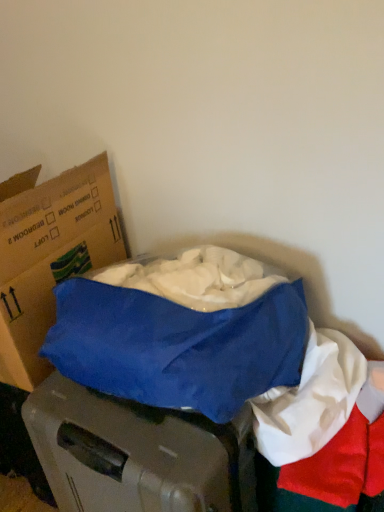
You are a GUI agent. You are given a task and a screenshot of the screen. Output one action in this format:
    pyautogui.click(x=<x>, y=<y>)
    Task: Click on the blue fabric at center
    Image resolution: width=384 pixels, height=512 pixels.
    Given the screenshot: What is the action you would take?
    pyautogui.click(x=310, y=400)

This screenshot has width=384, height=512. Describe the element at coordinates (310, 400) in the screenshot. I see `blue fabric at center` at that location.

What is the approximate height of blue fabric at center?

The height of blue fabric at center is 31.95 inches.

Where is `cardboard box at left`? This screenshot has width=384, height=512. cardboard box at left is located at coordinates (50, 258).

The image size is (384, 512). Describe the element at coordinates (50, 258) in the screenshot. I see `cardboard box at left` at that location.

Identify the location of blue fabric at center. This screenshot has width=384, height=512. (310, 400).

Considering the relative positions of blue fabric at center and cardboard box at left in the image provided, is blue fabric at center to the left or to the right of cardboard box at left?

blue fabric at center is positioned on cardboard box at left's right side.

Between blue fabric at center and cardboard box at left, which one is positioned in front?

blue fabric at center is in front.

Is point (284, 450) closer or farther from the camera than point (77, 169)?

Point (284, 450) appears to be closer to the viewer than point (77, 169).

From the image's perspective, which one is positioned lower, blue fabric at center or cardboard box at left?

blue fabric at center is shown below in the image.

From a real-world perspective, which object stands above the other?

cardboard box at left.

Considering the sizes of objects blue fabric at center and cardboard box at left in the image provided, who is thinner, blue fabric at center or cardboard box at left?

blue fabric at center.

Considering the relative sizes of blue fabric at center and cardboard box at left in the image provided, is blue fabric at center shorter than cardboard box at left?

Yes, blue fabric at center is shorter than cardboard box at left.

Does blue fabric at center have a larger size compared to cardboard box at left?

Actually, blue fabric at center might be smaller than cardboard box at left.

Is blue fabric at center completely or partially outside of cardboard box at left?

That's correct, blue fabric at center is outside of cardboard box at left.

Is blue fabric at center far from cardboard box at left?

They are positioned close to each other.

Does blue fabric at center turn towards cardboard box at left?

No, blue fabric at center is not oriented towards cardboard box at left.

The width and height of the screenshot is (384, 512). I want to click on linen directly beneath the cardboard box at left (from a real-world perspective), so click(x=310, y=400).

Between cardboard box at left and blue fabric at center, which one appears on the right side from the viewer's perspective?

blue fabric at center.

Is cardboard box at left further to camera compared to blue fabric at center?

Yes, cardboard box at left is behind blue fabric at center.

Is point (49, 217) closer to viewer compared to point (315, 418)?

No, it is not.

From the image's perspective, which is above, cardboard box at left or blue fabric at center?

cardboard box at left, from the image's perspective.

From a real-world perspective, which is physically below, cardboard box at left or blue fabric at center?

From a 3D spatial view, blue fabric at center is below.

Is cardboard box at left wider or thinner than blue fabric at center?

Clearly, cardboard box at left has more width compared to blue fabric at center.

Considering the sizes of cardboard box at left and blue fabric at center in the image, is cardboard box at left taller or shorter than blue fabric at center?

cardboard box at left is taller than blue fabric at center.

Is cardboard box at left smaller than blue fabric at center?

Actually, cardboard box at left might be larger than blue fabric at center.

Is cardboard box at left completely or partially outside of blue fabric at center?

Indeed, cardboard box at left is completely outside blue fabric at center.

Is cardboard box at left beside blue fabric at center?

No, cardboard box at left is not beside blue fabric at center.

Consider the image. Is blue fabric at center at the back of cardboard box at left?

No, cardboard box at left's orientation is not away from blue fabric at center.

Looking at this image, what's the angular difference between cardboard box at left and blue fabric at center's facing directions?

There is a 0.322-degree angle between the facing directions of cardboard box at left and blue fabric at center.

How distant is cardboard box at left from blue fabric at center?

cardboard box at left and blue fabric at center are 25.37 inches apart.

Locate an element on the screen. The image size is (384, 512). linen below the cardboard box at left (from the image's perspective) is located at coordinates (310, 400).

The image size is (384, 512). What are the coordinates of `linen that is below the cardboard box at left (from the image's perspective)` in the screenshot? It's located at (310, 400).

Identify the location of box located behind the blue fabric at center. (50, 258).